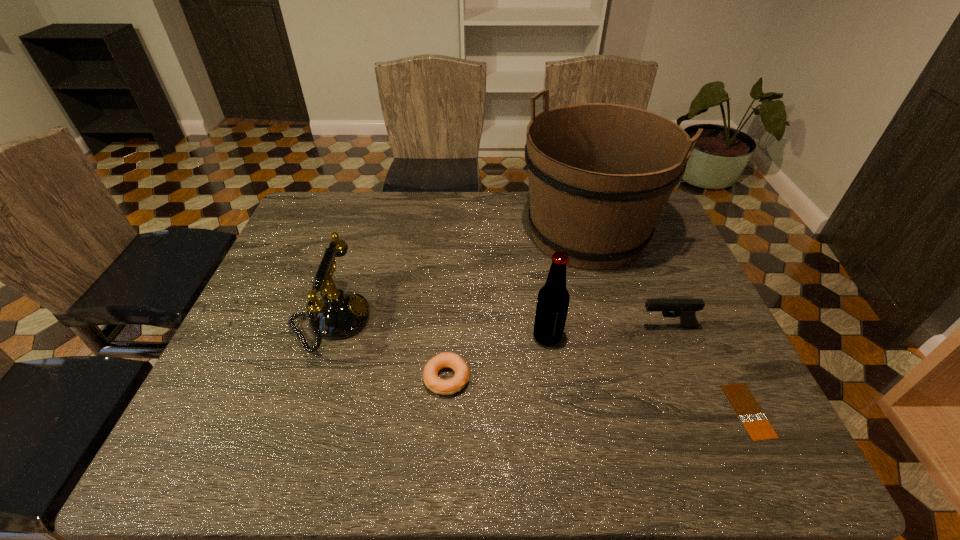
Locate an element on the screen. The height and width of the screenshot is (540, 960). free space located 0.250m on the left of the second tallest object is located at coordinates (432, 337).

In order to click on free space located 0.180m on the dial of the telephone in this screenshot , I will do `click(440, 321)`.

Find the location of a particular element. The height and width of the screenshot is (540, 960). blank space located 0.350m on the front-facing side of the third shortest object is located at coordinates (499, 327).

Identify the location of free spot located 0.100m on the front-facing side of the third shortest object. (598, 327).

Find the location of `vacant space located on the front-facing side of the third shortest object`. vacant space located on the front-facing side of the third shortest object is located at coordinates (589, 327).

Find the location of a particular element. This screenshot has height=540, width=960. vacant space located 0.200m on the left of the bagel is located at coordinates (336, 378).

At what (x,y) coordinates should I click in order to perform the action: click on vacant space located on the left of the chocolate bar. Please return your answer as a coordinate pair (x, y). Looking at the image, I should click on (699, 411).

At what (x,y) coordinates should I click in order to perform the action: click on object present at the far edge. Please return your answer as a coordinate pair (x, y). This screenshot has height=540, width=960. Looking at the image, I should click on (600, 174).

Identify the location of object that is at the near edge. (751, 415).

You are a GUI agent. You are given a task and a screenshot of the screen. Output one action in this format:
    pyautogui.click(x=<x>, y=<y>)
    Task: Click on the object present at the left edge
    
    Given the screenshot: What is the action you would take?
    pyautogui.click(x=337, y=315)